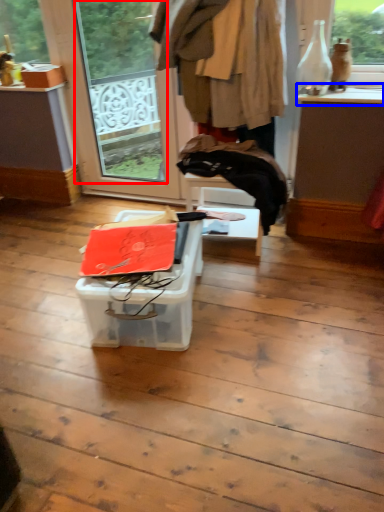
Question: Which of the following is the farthest to the observer, window screen (highlighted by a red box) or window sill (highlighted by a blue box)?

Choices:
 (A) window screen
 (B) window sill

Answer: (A)